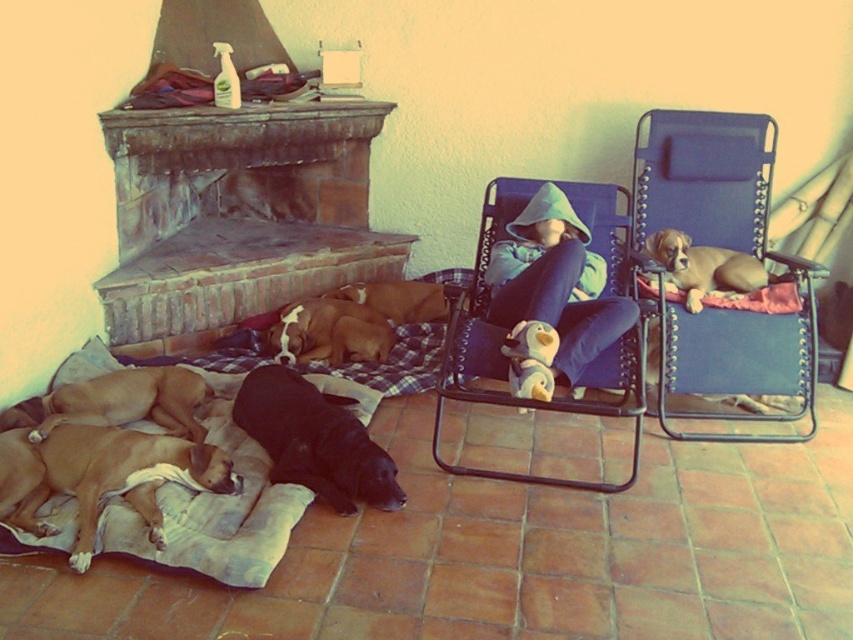
Measure the distance from black smooth dog at lower left to golden brown fur at lower left.

They are 15.72 inches apart.

Who is shorter, black smooth dog at lower left or golden brown fur at lower left?

golden brown fur at lower left is shorter.

Is point (393, 499) positioned before point (177, 413)?

Yes, it is.

Where is `black smooth dog at lower left`? black smooth dog at lower left is located at coordinates (315, 440).

Looking at this image, does matte blue folding chair at right appear on the right side of brown fur at center?

Correct, you'll find matte blue folding chair at right to the right of brown fur at center.

Is point (729, 440) behind point (285, 340)?

No, it is in front of (285, 340).

Locate an element on the screen. The width and height of the screenshot is (853, 640). matte blue folding chair at right is located at coordinates (722, 248).

Can you confirm if green fleece hoodie at center is thinner than golden brown fur at lower left?

Yes.

Is green fleece hoodie at center positioned behind golden brown fur at lower left?

Yes, green fleece hoodie at center is further from the viewer.

Where is `green fleece hoodie at center`? green fleece hoodie at center is located at coordinates [553, 289].